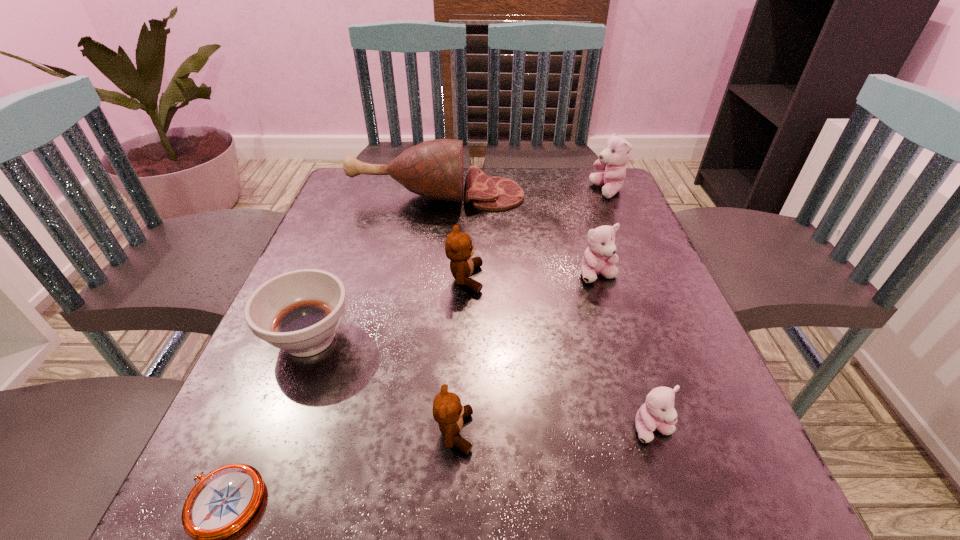
The height and width of the screenshot is (540, 960). I want to click on vacant space located 0.200m at the face of the rightmost teddy bear, so click(x=516, y=191).

Locate an element on the screen. This screenshot has height=540, width=960. vacant space located 0.250m at the face of the rightmost teddy bear is located at coordinates [x=497, y=191].

Identify the location of vacant area situated on the front-facing side of the farther brown teddy bear. The image size is (960, 540). (622, 279).

Find the location of `vacant space situated at the face of the second farthest pink teddy bear`. vacant space situated at the face of the second farthest pink teddy bear is located at coordinates pos(648,437).

The image size is (960, 540). In order to click on blank space located on the front of the soup bowl in this screenshot , I will do `click(277, 423)`.

You are a GUI agent. You are given a task and a screenshot of the screen. Output one action in this format:
    pyautogui.click(x=<x>, y=<y>)
    Task: Click on the vacant space located on the front-facing side of the nearer brown teddy bear
    This screenshot has height=540, width=960.
    Given the screenshot: What is the action you would take?
    pyautogui.click(x=681, y=432)

Identify the location of blank space located 0.110m at the face of the smallest pink teddy bear. (685, 529).

At what (x,y) coordinates should I click in order to perform the action: click on ham at the far edge. Please return your answer as a coordinate pair (x, y). Looking at the image, I should click on (433, 169).

What are the coordinates of `teddy bear located at the far edge` in the screenshot? It's located at (616, 154).

Where is `ham present at the left edge`? ham present at the left edge is located at coordinates (433, 169).